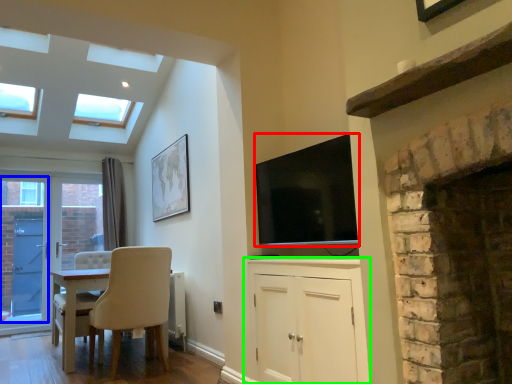
Question: Considering the real-world distances, which object is farthest from television (highlighted by a red box)? glass door (highlighted by a blue box) or cabinetry (highlighted by a green box)?

Choices:
 (A) glass door
 (B) cabinetry

Answer: (A)